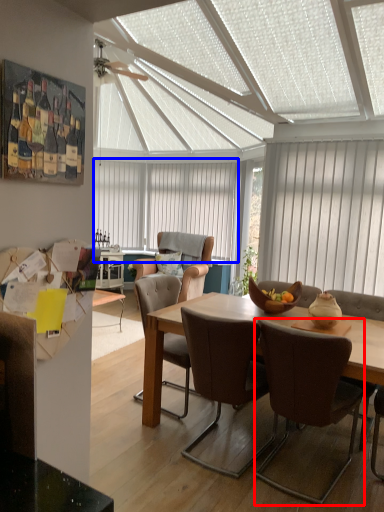
Question: Which point is further to the camera, chair (highlighted by a red box) or window (highlighted by a blue box)?

Choices:
 (A) chair
 (B) window

Answer: (B)